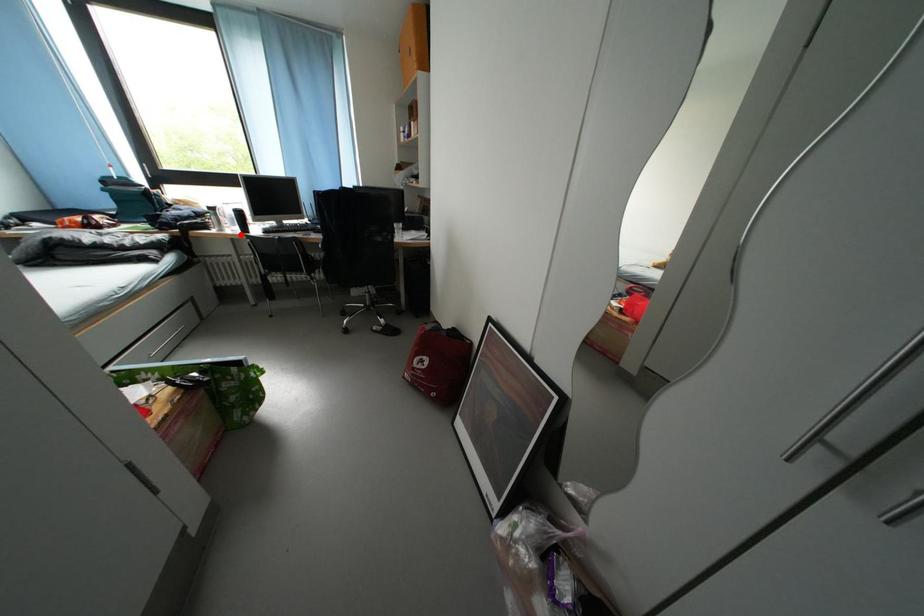
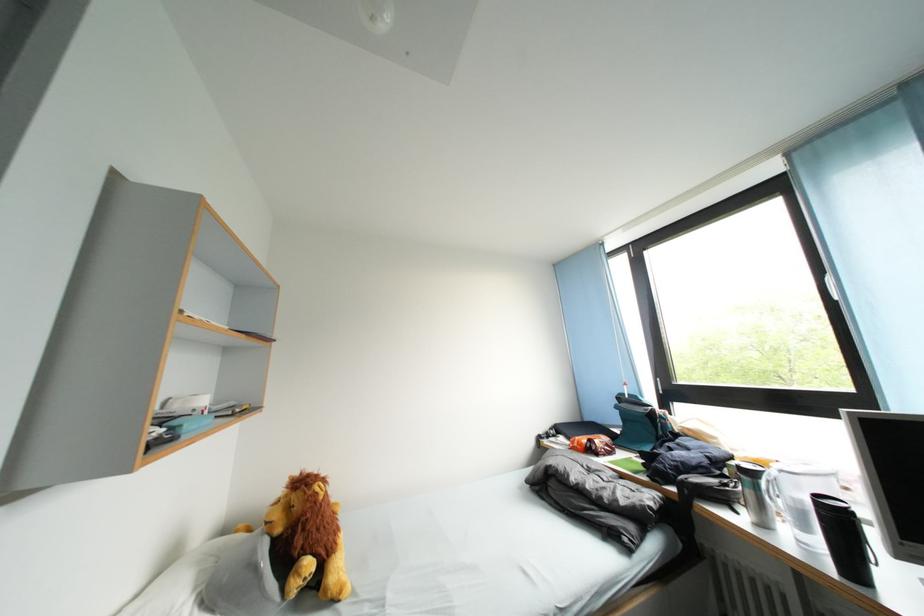
Where in the second image is the point corresponding to the highlighted location from the first image?

(808, 546)